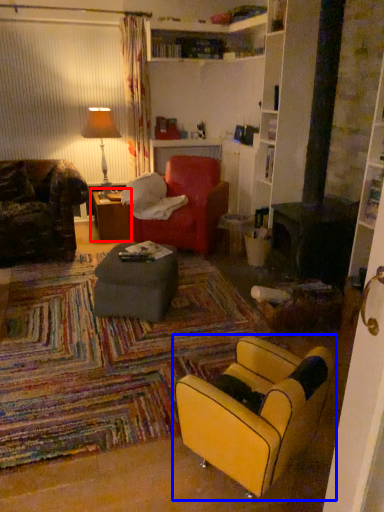
Question: Which object appears closest to the camera in this image, table (highlighted by a red box) or chair (highlighted by a blue box)?

Choices:
 (A) table
 (B) chair

Answer: (B)